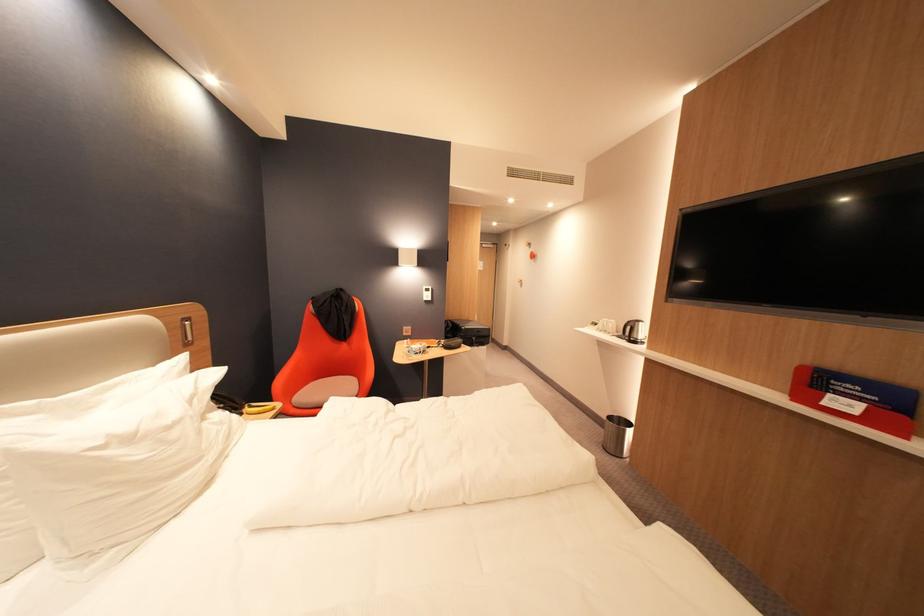
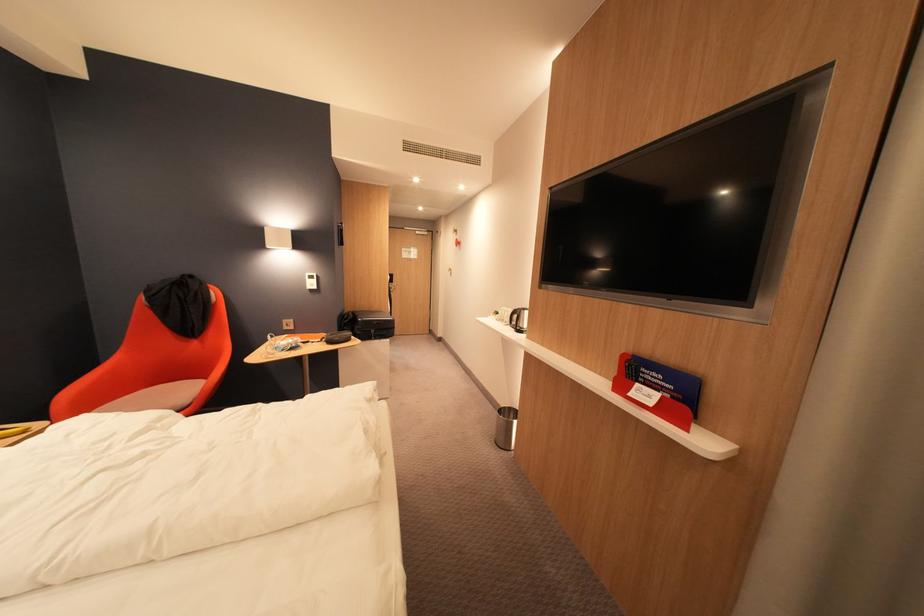
Where in the second image is the point corresponding to the point at 624,322 from the first image?

(519, 310)